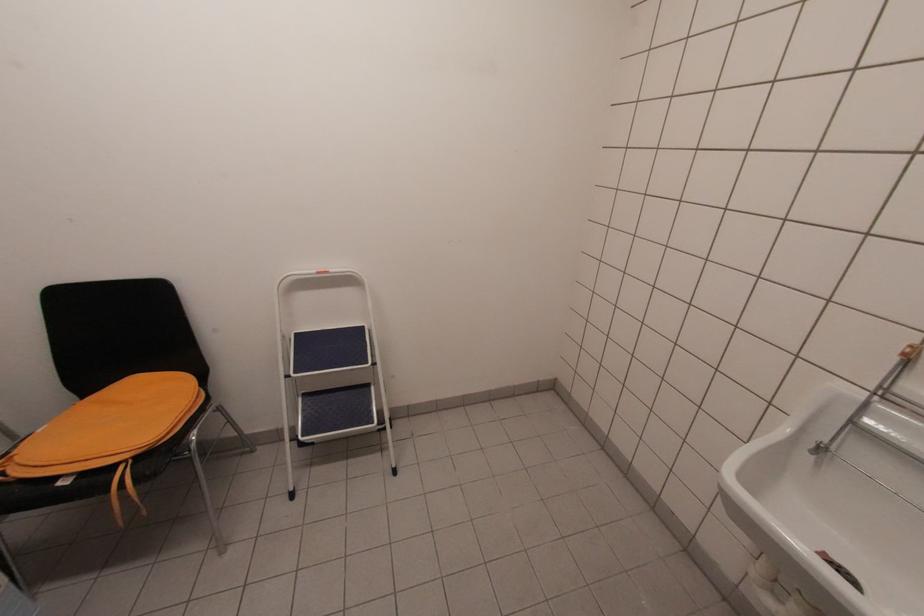
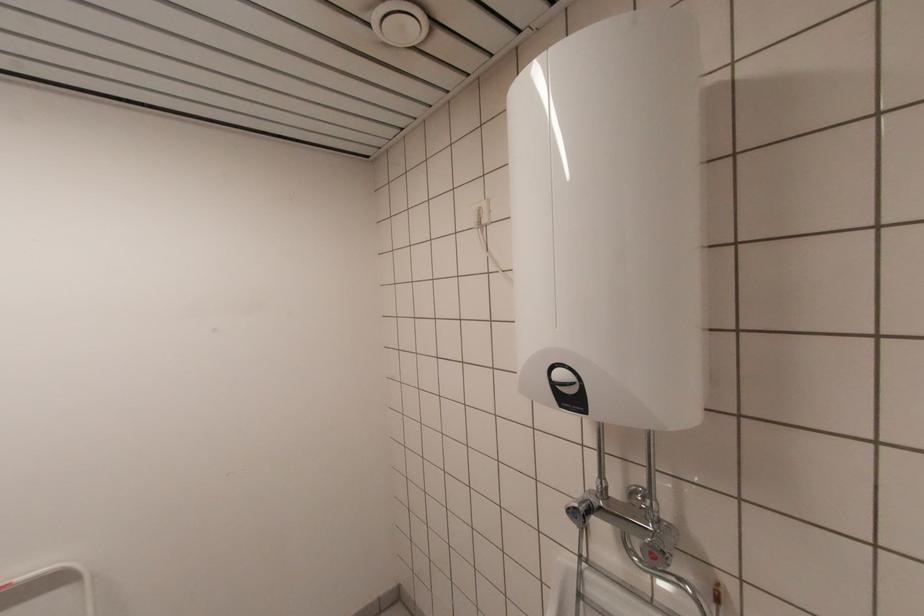
Based on the continuous images, in which direction is the camera rotating?

The camera's rotation is toward right-up.